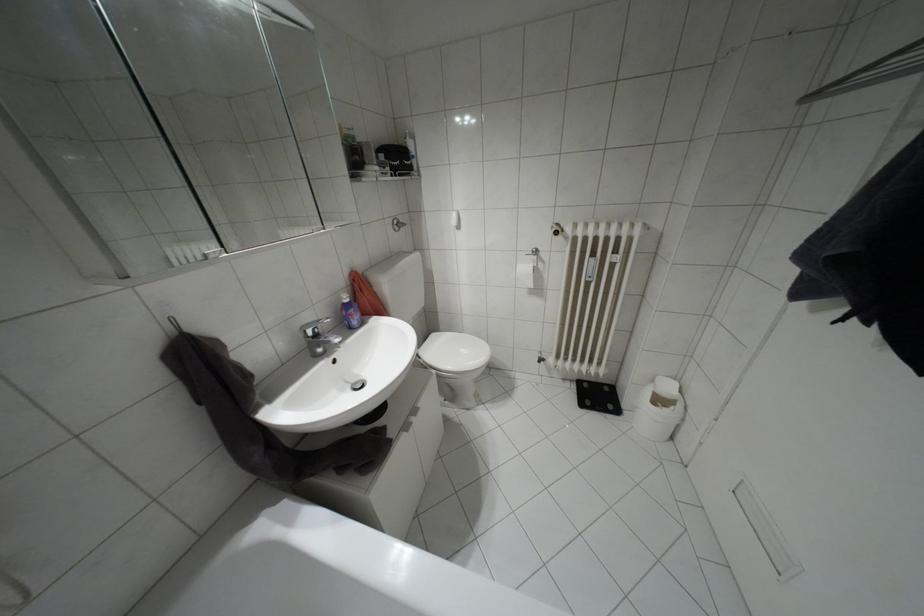
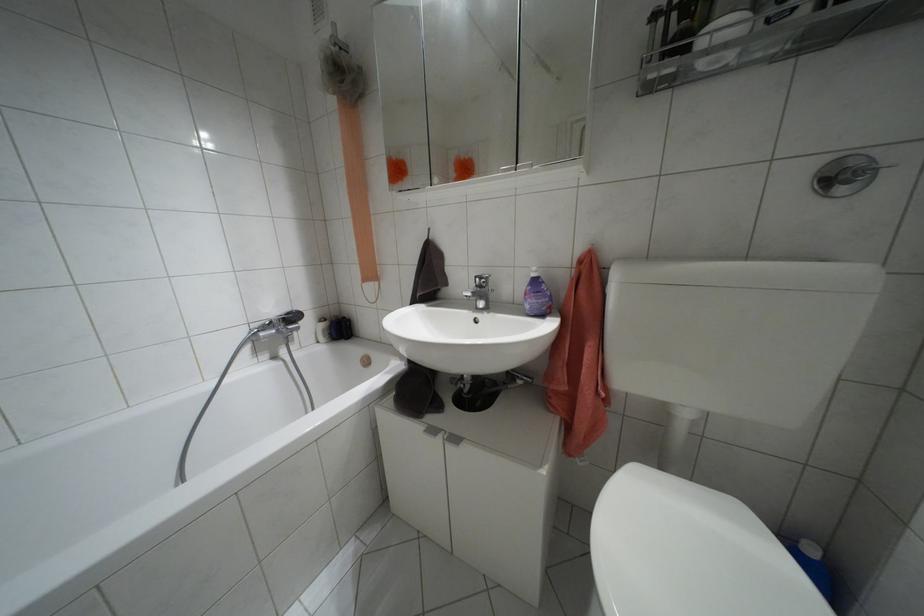
In the second image, find the point that corresponds to (x=346, y=300) in the first image.

(532, 274)